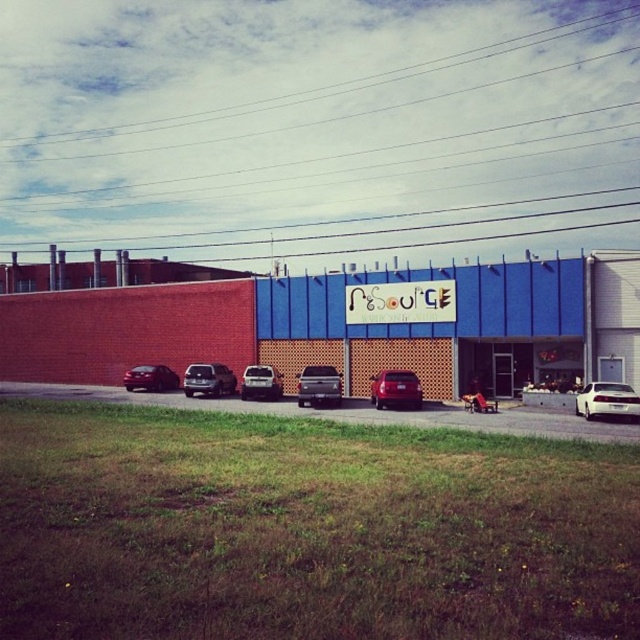
Between metallic silver truck at center and shiny black sedan at left, which one is positioned higher?

metallic silver truck at center is above.

Between metallic silver truck at center and shiny black sedan at left, which one is positioned lower?

shiny black sedan at left is lower down.

Between point (323, 397) and point (173, 371), which one is positioned behind?

Point (173, 371)

I want to click on metallic silver truck at center, so click(x=317, y=385).

Between metallic silver car at center and white glossy car at right, which one is positioned lower?

metallic silver car at center

Is metallic silver car at center taller than white glossy car at right?

Yes.

Image resolution: width=640 pixels, height=640 pixels. Identify the location of metallic silver car at center. (349, 412).

The width and height of the screenshot is (640, 640). I want to click on metallic silver car at center, so click(349, 412).

From the picture: Is green grass at lower center to the right of metallic silver car at center from the viewer's perspective?

Correct, you'll find green grass at lower center to the right of metallic silver car at center.

Who is positioned more to the right, green grass at lower center or metallic silver car at center?

green grass at lower center is more to the right.

Which is behind, point (634, 563) or point (604, 424)?

The point (604, 424) is more distant.

Find the location of a particular element. The height and width of the screenshot is (640, 640). green grass at lower center is located at coordinates (307, 529).